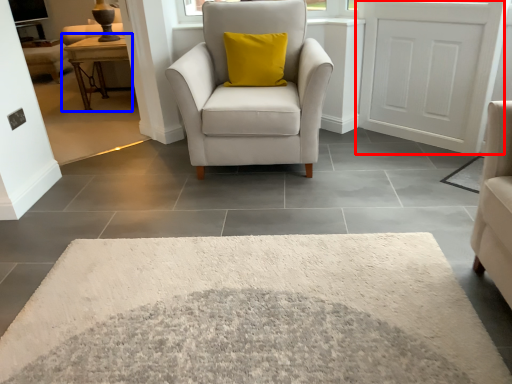
Question: Which object appears closest to the camera in this image, door (highlighted by a red box) or table (highlighted by a blue box)?

Choices:
 (A) door
 (B) table

Answer: (A)